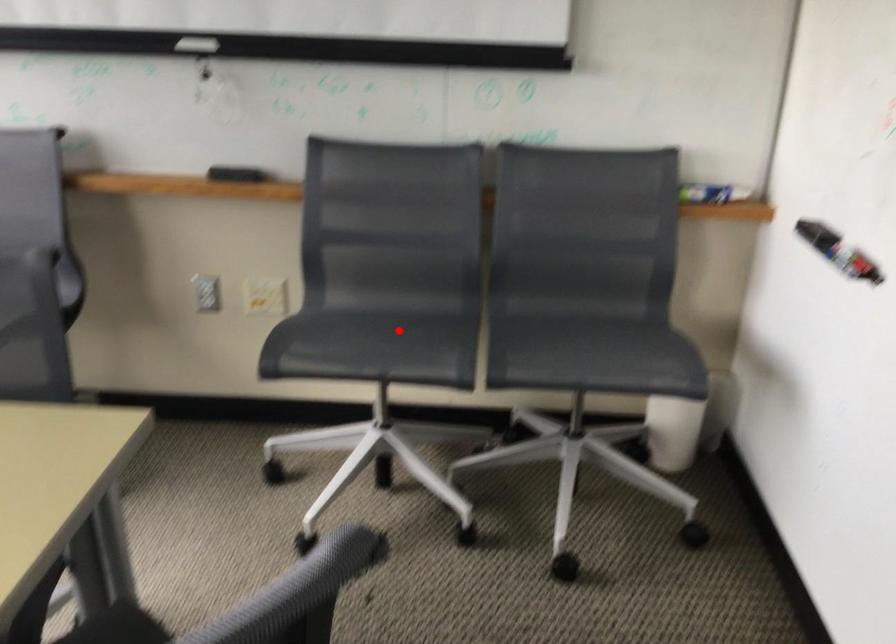
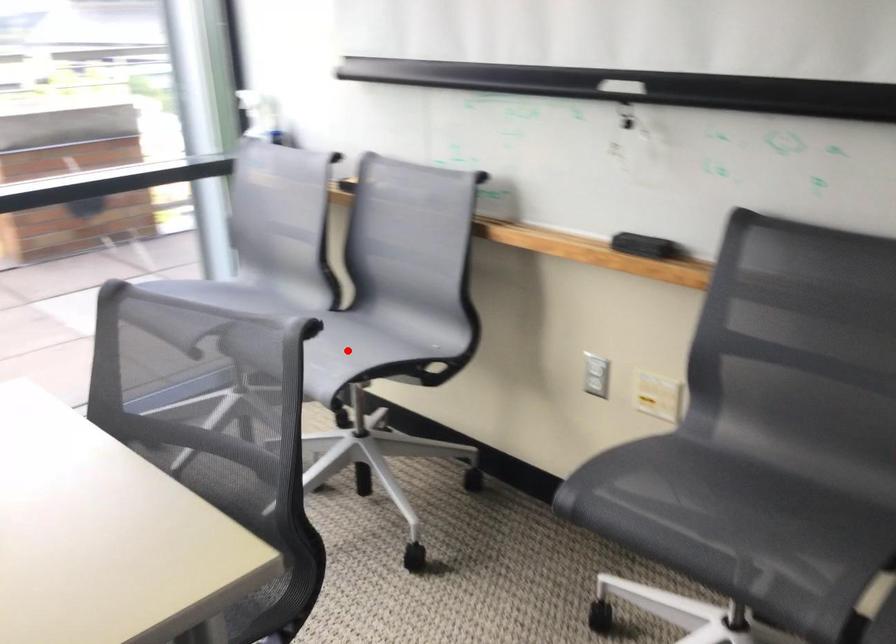
I am providing you with two images of the same scene from different viewpoints. A red point is marked on the first image and another point is marked on the second image. Is the marked point in image1 the same physical position as the marked point in image2?

No